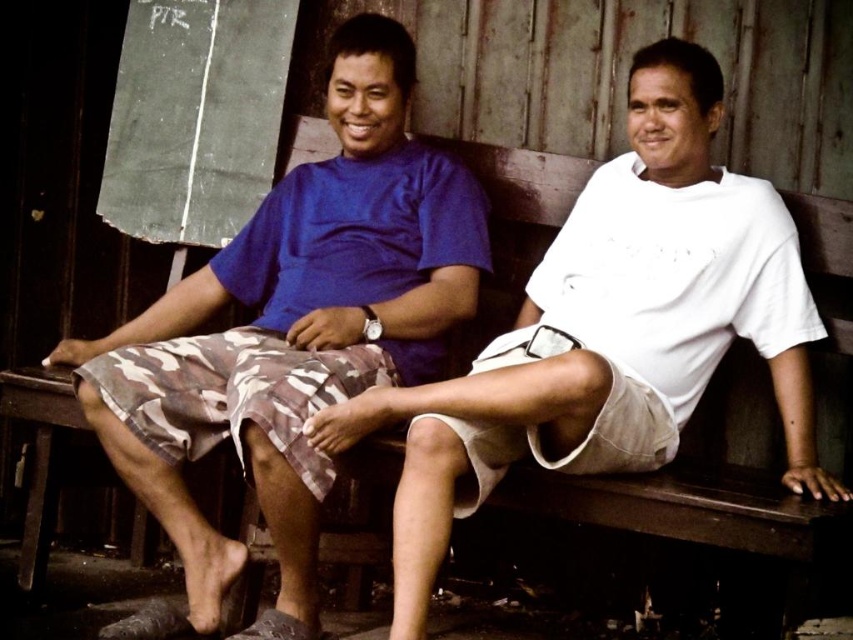
Question: Is matte blue t-shirt at center closer to camera compared to matte blue shirt at center?

Choices:
 (A) no
 (B) yes

Answer: (A)

Question: Which point is closer to the camera?

Choices:
 (A) matte blue t-shirt at center
 (B) matte blue shirt at center

Answer: (B)

Question: Which point is closer to the camera?

Choices:
 (A) (672, 182)
 (B) (106, 342)

Answer: (A)

Question: Is matte blue t-shirt at center closer to camera compared to matte blue shirt at center?

Choices:
 (A) yes
 (B) no

Answer: (B)

Question: In this image, where is matte blue t-shirt at center located relative to matte blue shirt at center?

Choices:
 (A) below
 (B) above

Answer: (B)